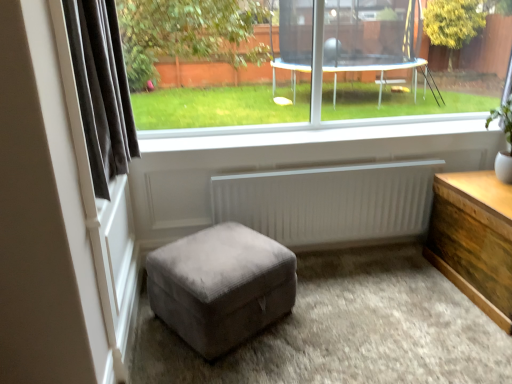
Question: From the image's perspective, is white ribbed radiator at center on top of dark grey fabric curtain at left?

Choices:
 (A) no
 (B) yes

Answer: (A)

Question: Is white ribbed radiator at center at the right side of dark grey fabric curtain at left?

Choices:
 (A) no
 (B) yes

Answer: (B)

Question: Would you say white ribbed radiator at center contains dark grey fabric curtain at left?

Choices:
 (A) yes
 (B) no

Answer: (B)

Question: Considering the relative sizes of white ribbed radiator at center and dark grey fabric curtain at left in the image provided, is white ribbed radiator at center thinner than dark grey fabric curtain at left?

Choices:
 (A) no
 (B) yes

Answer: (B)

Question: Considering the relative sizes of white ribbed radiator at center and dark grey fabric curtain at left in the image provided, is white ribbed radiator at center shorter than dark grey fabric curtain at left?

Choices:
 (A) yes
 (B) no

Answer: (A)

Question: Is white ribbed radiator at center positioned far away from dark grey fabric curtain at left?

Choices:
 (A) no
 (B) yes

Answer: (B)

Question: Is white smooth window sill at center positioned far away from transparent glass window at center?

Choices:
 (A) no
 (B) yes

Answer: (B)

Question: Considering the relative sizes of white smooth window sill at center and transparent glass window at center in the image provided, is white smooth window sill at center shorter than transparent glass window at center?

Choices:
 (A) no
 (B) yes

Answer: (B)

Question: Does white smooth window sill at center have a lesser width compared to transparent glass window at center?

Choices:
 (A) no
 (B) yes

Answer: (A)

Question: Considering the relative sizes of white smooth window sill at center and transparent glass window at center in the image provided, is white smooth window sill at center bigger than transparent glass window at center?

Choices:
 (A) yes
 (B) no

Answer: (B)

Question: Does white smooth window sill at center have a greater height compared to transparent glass window at center?

Choices:
 (A) no
 (B) yes

Answer: (A)

Question: From a real-world perspective, is white smooth window sill at center beneath transparent glass window at center?

Choices:
 (A) no
 (B) yes

Answer: (B)

Question: From the image's perspective, is wooden chest at right over white smooth window sill at center?

Choices:
 (A) no
 (B) yes

Answer: (A)